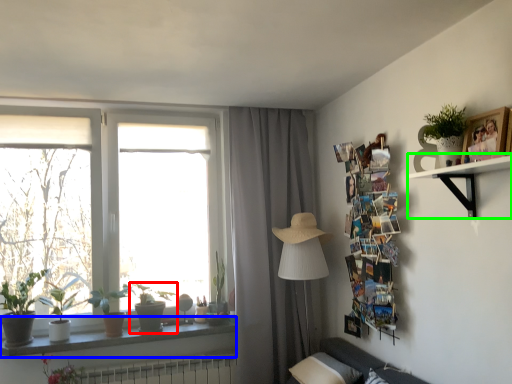
Question: Considering the real-world distances, which object is farthest from houseplant (highlighted by a red box)? window sill (highlighted by a blue box) or shelf (highlighted by a green box)?

Choices:
 (A) window sill
 (B) shelf

Answer: (B)